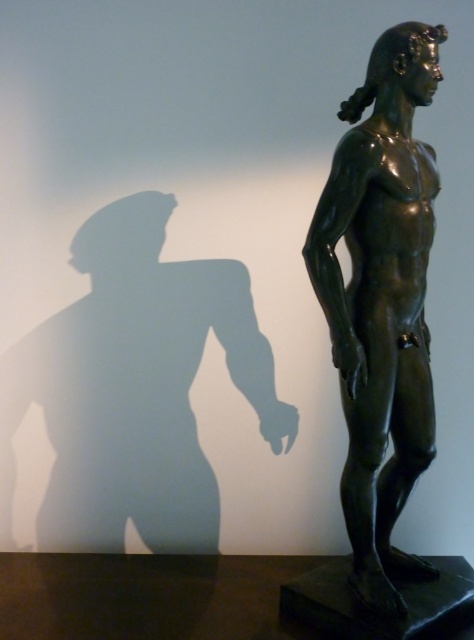
You are an art curator planning to display two bronze statues in a gallery. The bronze statue at upper center and the shiny bronze statue at center are both part of your collection. Which statue should you place on a higher pedestal to ensure both statues appear balanced in height when viewed from the front?

The bronze statue at upper center is not as tall as the shiny bronze statue at center, so placing it on a higher pedestal would balance their heights when viewed from the front.

You are a photographer standing at a certain distance from the bronze statue at upper center. You want to capture a full view of the statue without any part being cut off. What is the minimum distance you should maintain from the statue to ensure the entire statue fits in your camera frame?

The minimum distance you should maintain from the bronze statue at upper center is 1.92 meters to ensure the entire statue fits in your camera frame.